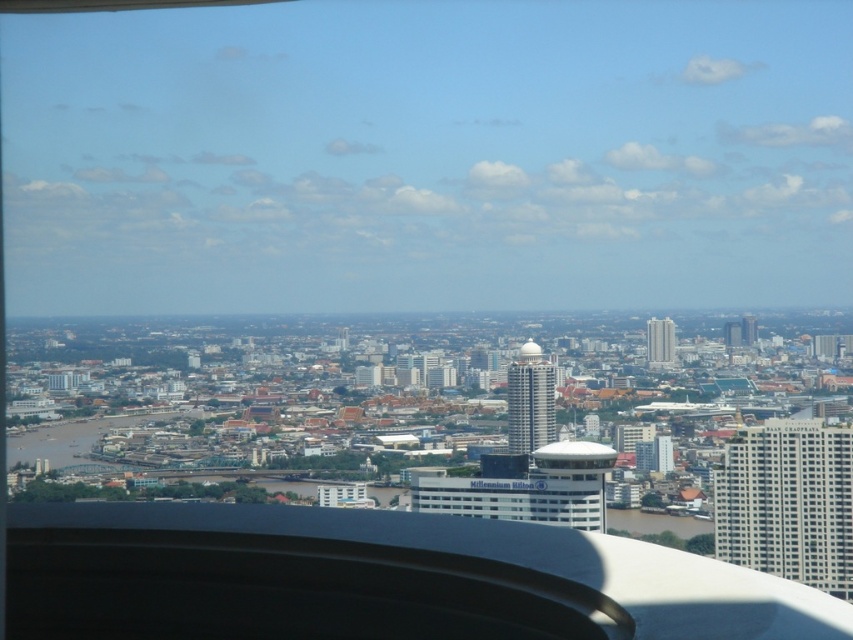
You are standing on a balcony and want to take a photo of two points in the city. The first point is at coordinates point (548, 417) and the second is at point (734, 333). Which point will appear closer to the camera in your photo?

Point (548, 417) is in front of point (734, 333), so it will appear closer to the camera in the photo.